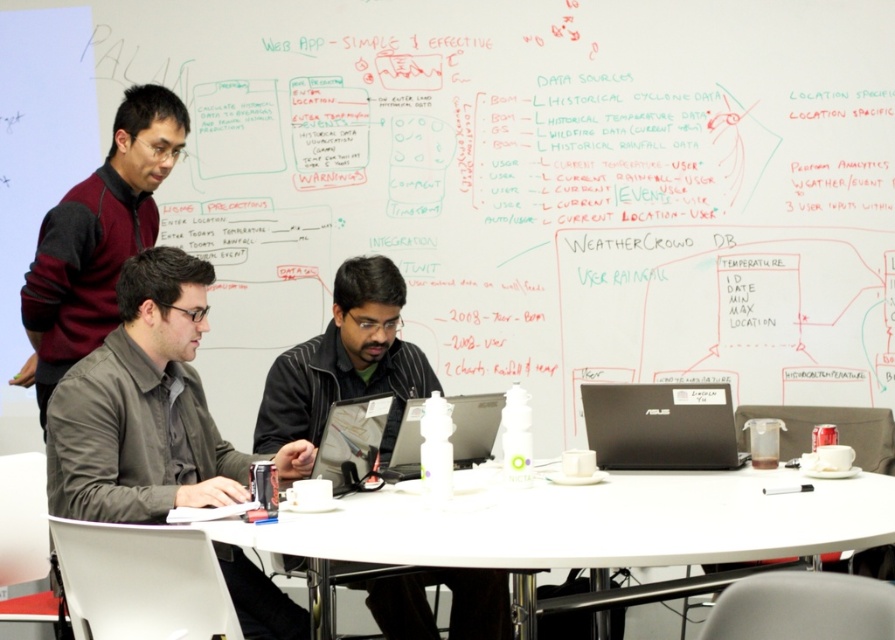
Question: Which point appears closest to the camera in this image?

Choices:
 (A) (364, 426)
 (B) (641, 460)
 (C) (612, 112)
 (D) (413, 412)

Answer: (A)

Question: Which object is positioned farthest from the dark gray shirt at center?

Choices:
 (A) silver metallic laptop at center
 (B) white plastic table at center
 (C) maroon sweater at upper left
 (D) black matte shirt at center

Answer: (C)

Question: Is white plastic table at center closer to the viewer compared to black matte laptop at center?

Choices:
 (A) yes
 (B) no

Answer: (A)

Question: Is matte black laptop at center wider than silver metallic laptop at center?

Choices:
 (A) no
 (B) yes

Answer: (A)

Question: Which point is closer to the camera?

Choices:
 (A) (361, 392)
 (B) (152, 358)
 (C) (376, 460)
 (D) (388, 476)

Answer: (B)

Question: Is whiteboard at upper center bigger than black matte shirt at center?

Choices:
 (A) no
 (B) yes

Answer: (B)